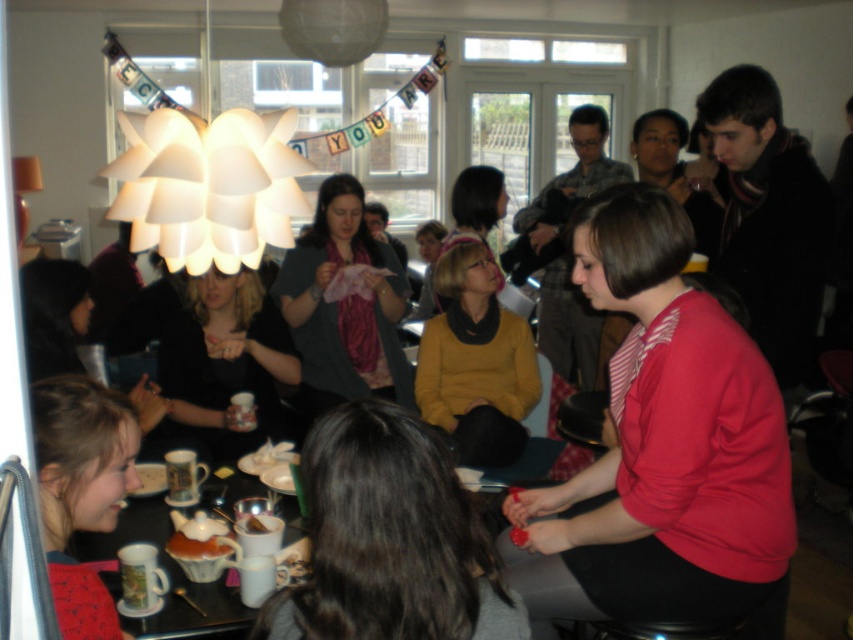
Question: Can you confirm if matte red blouse at center is bigger than matte gray scarf at center?

Choices:
 (A) no
 (B) yes

Answer: (A)

Question: Which point appears closest to the camera in this image?

Choices:
 (A) (68, 410)
 (B) (259, 292)

Answer: (A)

Question: Estimate the real-world distances between objects in this image. Which object is closer to the matte ceramic teapot at lower left?

Choices:
 (A) matte black sweater at center
 (B) smooth white cake at center
 (C) smooth chocolate cake at lower center

Answer: (C)

Question: Is matte red blouse at center positioned behind smooth white cake at center?

Choices:
 (A) no
 (B) yes

Answer: (A)

Question: Can you confirm if matte yellow sweater at center is wider than matte ceramic mug at lower left?

Choices:
 (A) no
 (B) yes

Answer: (B)

Question: Among these points, which one is nearest to the camera?

Choices:
 (A) (80, 307)
 (B) (67, 525)

Answer: (B)